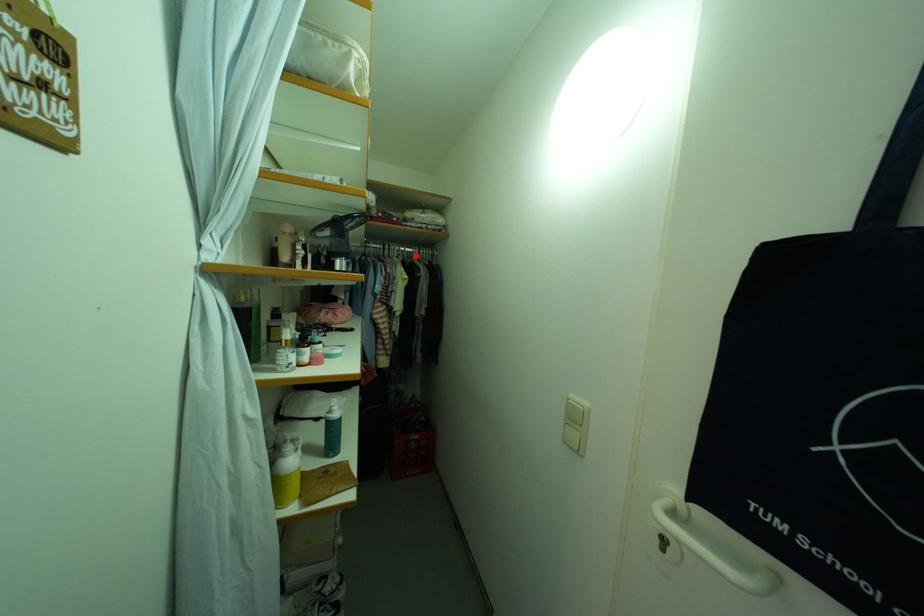
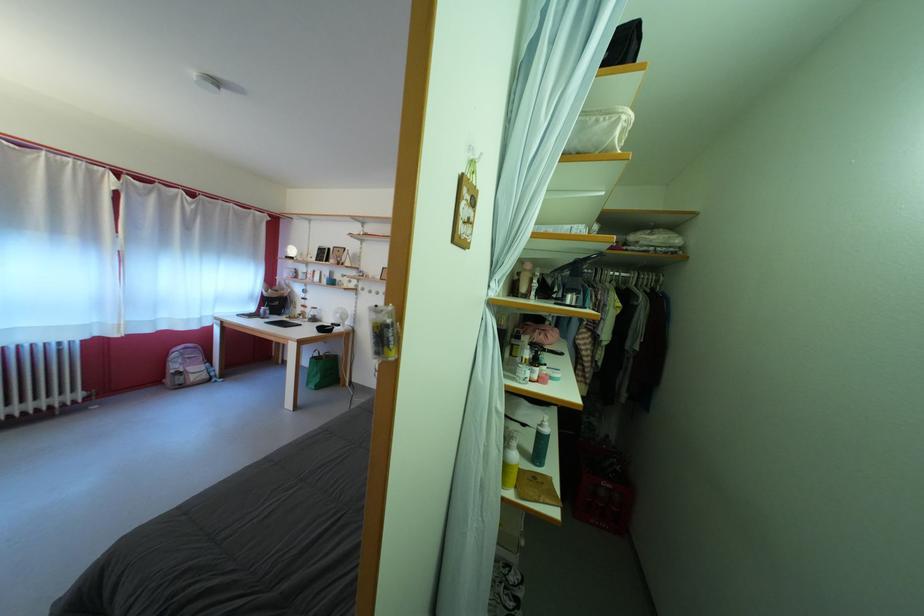
Where in the second image is the point corresponding to the highlighted location from the first image?

(631, 281)